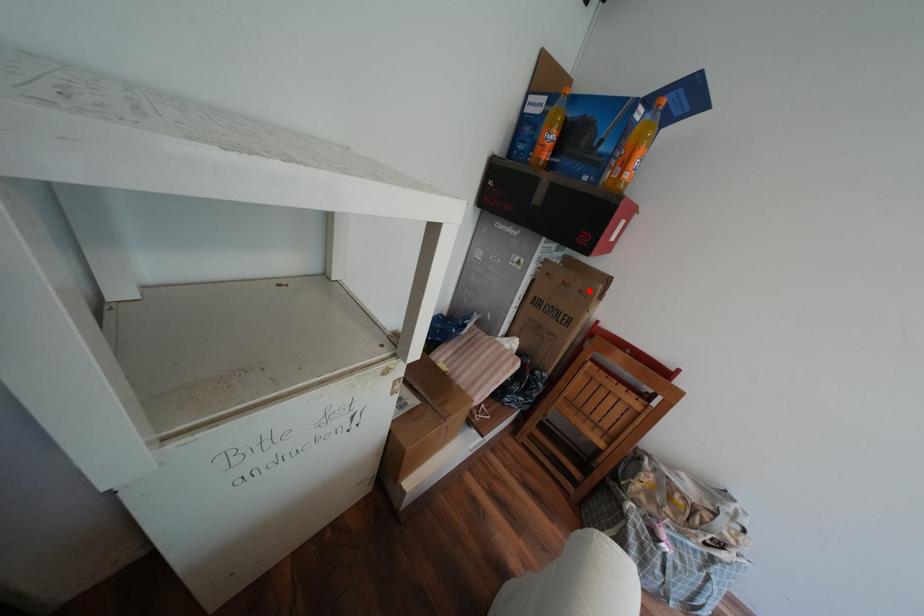
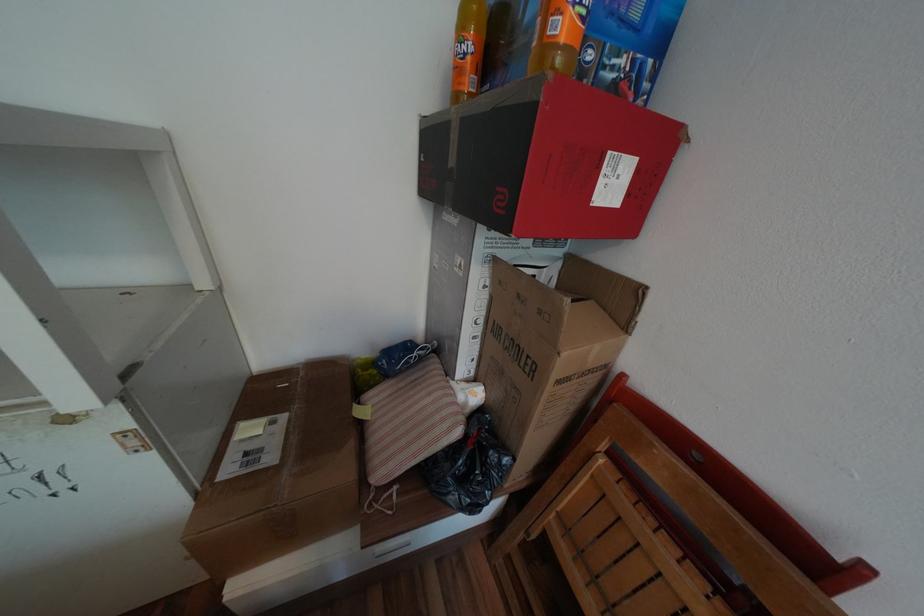
In the second image, find the point that corresponds to the highlighted location in the first image.

(550, 312)